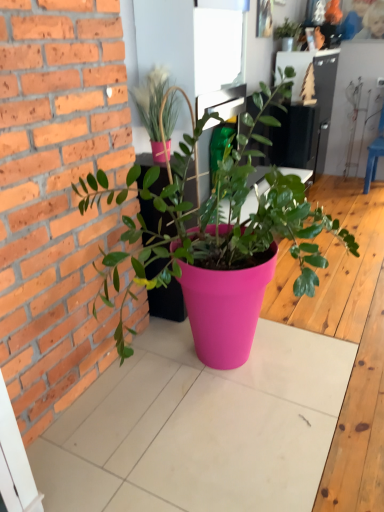
In order to face matte green plant at upper center, which ranks as the first houseplant in back-to-front order, should I rotate leftwards or rightwards?

Rotate your view right by about 12.930°.

Image resolution: width=384 pixels, height=512 pixels. What do you see at coordinates (288, 35) in the screenshot?
I see `matte green plant at upper center, which ranks as the first houseplant in back-to-front order` at bounding box center [288, 35].

I want to click on pink plastic pot at center, acting as the 3th houseplant starting from the top, so click(231, 236).

Does pink plastic pot at center, arranged as the third houseplant when viewed from the back, turn towards blue plastic chair at right?

No.

Do you think pink plastic pot at center, arranged as the first houseplant when viewed from the front, is within blue plastic chair at right, or outside of it?

pink plastic pot at center, arranged as the first houseplant when viewed from the front, is located beyond the bounds of blue plastic chair at right.

From the image's perspective, which one is positioned higher, pink plastic pot at center, arranged as the first houseplant when viewed from the front, or blue plastic chair at right?

blue plastic chair at right, from the image's perspective.

Considering the sizes of objects matte pink pot at upper center, the second houseplant in the front-to-back sequence, and pink plastic pot at center, arranged as the first houseplant when viewed from the front, in the image provided, who is taller, matte pink pot at upper center, the second houseplant in the front-to-back sequence, or pink plastic pot at center, arranged as the first houseplant when viewed from the front,?

pink plastic pot at center, arranged as the first houseplant when viewed from the front.

From the image's perspective, relative to pink plastic pot at center, arranged as the third houseplant when viewed from the back, is matte pink pot at upper center, acting as the second houseplant starting from the bottom, above or below?

matte pink pot at upper center, acting as the second houseplant starting from the bottom, is situated higher than pink plastic pot at center, arranged as the third houseplant when viewed from the back, in the image.

Is matte pink pot at upper center, arranged as the second houseplant when viewed from the top, not within pink plastic pot at center, acting as the 3th houseplant starting from the top?

That's incorrect, matte pink pot at upper center, arranged as the second houseplant when viewed from the top, is not completely outside pink plastic pot at center, acting as the 3th houseplant starting from the top.

How many degrees apart are the facing directions of matte pink pot at upper center, the second houseplant in the front-to-back sequence, and pink plastic pot at center, acting as the 3th houseplant starting from the top?

They differ by 0.088 degrees in their facing directions.

Is blue plastic chair at right at the back of matte pink pot at upper center, the second houseplant in the front-to-back sequence?

No, matte pink pot at upper center, the second houseplant in the front-to-back sequence, is not facing away from blue plastic chair at right.

Is matte pink pot at upper center, arranged as the second houseplant when viewed from the top, taller or shorter than blue plastic chair at right?

Considering their sizes, matte pink pot at upper center, arranged as the second houseplant when viewed from the top, has less height than blue plastic chair at right.

Between point (147, 128) and point (382, 134), which one is positioned behind?

Point (382, 134)

Between matte pink pot at upper center, the second houseplant in the front-to-back sequence, and blue plastic chair at right, which one has smaller size?

A: matte pink pot at upper center, the second houseplant in the front-to-back sequence, is smaller.

Locate an element on the screen. the 1st houseplant in front of the blue plastic chair at right is located at coordinates (288, 35).

Is matte green plant at upper center, the 3th houseplant viewed from the front, taller than blue plastic chair at right?

No, matte green plant at upper center, the 3th houseplant viewed from the front, is not taller than blue plastic chair at right.

Which is more to the left, matte green plant at upper center, the first houseplant positioned from the top, or blue plastic chair at right?

From the viewer's perspective, matte green plant at upper center, the first houseplant positioned from the top, appears more on the left side.

In order to click on houseplant that is the 3rd one when counting leftward from the blue plastic chair at right in this screenshot , I will do `click(152, 106)`.

How many degrees apart are the facing directions of blue plastic chair at right and matte pink pot at upper center, acting as the second houseplant starting from the bottom?

The angular difference between blue plastic chair at right and matte pink pot at upper center, acting as the second houseplant starting from the bottom, is 91.3 degrees.

Does point (383, 137) come in front of point (150, 141)?

No, (383, 137) is further to viewer.

Can you confirm if blue plastic chair at right is wider than matte pink pot at upper center, acting as the second houseplant starting from the bottom?

Yes, blue plastic chair at right is wider than matte pink pot at upper center, acting as the second houseplant starting from the bottom.

Is matte green plant at upper center, which ranks as the first houseplant in back-to-front order, not close to pink plastic pot at center, marked as the 1th houseplant in a bottom-to-top arrangement?

Yes, matte green plant at upper center, which ranks as the first houseplant in back-to-front order, and pink plastic pot at center, marked as the 1th houseplant in a bottom-to-top arrangement, are located far from each other.

Is matte green plant at upper center, the third houseplant when ordered from bottom to top, completely or partially outside of pink plastic pot at center, arranged as the first houseplant when viewed from the front?

Absolutely, matte green plant at upper center, the third houseplant when ordered from bottom to top, is external to pink plastic pot at center, arranged as the first houseplant when viewed from the front.

Considering their positions, is matte green plant at upper center, which ranks as the first houseplant in back-to-front order, located in front of or behind pink plastic pot at center, arranged as the first houseplant when viewed from the front?

Clearly, matte green plant at upper center, which ranks as the first houseplant in back-to-front order, is behind pink plastic pot at center, arranged as the first houseplant when viewed from the front.

From the picture: From a real-world perspective, between matte green plant at upper center, the 3th houseplant viewed from the front, and pink plastic pot at center, arranged as the third houseplant when viewed from the back, who is vertically higher?

In real-world perspective, matte green plant at upper center, the 3th houseplant viewed from the front, is above.

Considering the sizes of objects pink plastic pot at center, arranged as the first houseplant when viewed from the front, and matte green plant at upper center, the 3th houseplant viewed from the front, in the image provided, who is taller, pink plastic pot at center, arranged as the first houseplant when viewed from the front, or matte green plant at upper center, the 3th houseplant viewed from the front,?

pink plastic pot at center, arranged as the first houseplant when viewed from the front, is taller.

Find the location of a particular element. This screenshot has height=512, width=384. the 2nd houseplant above the pink plastic pot at center, arranged as the third houseplant when viewed from the back (from the image's perspective) is located at coordinates (288, 35).

Considering the sizes of pink plastic pot at center, acting as the 3th houseplant starting from the top, and matte green plant at upper center, which ranks as the first houseplant in back-to-front order, in the image, is pink plastic pot at center, acting as the 3th houseplant starting from the top, bigger or smaller than matte green plant at upper center, which ranks as the first houseplant in back-to-front order,?

Considering their sizes, pink plastic pot at center, acting as the 3th houseplant starting from the top, takes up more space than matte green plant at upper center, which ranks as the first houseplant in back-to-front order.

The height and width of the screenshot is (512, 384). I want to click on houseplant that is the 2nd one when counting downward from the blue plastic chair at right (from the image's perspective), so click(x=231, y=236).

Locate an element on the screen. The image size is (384, 512). houseplant that appears below the matte pink pot at upper center, the second houseplant in the front-to-back sequence (from a real-world perspective) is located at coordinates (231, 236).

When comparing their distances from matte green plant at upper center, the 3th houseplant viewed from the front, does pink plastic pot at center, arranged as the first houseplant when viewed from the front, or matte pink pot at upper center, arranged as the second houseplant when viewed from the top, seem closer?

matte pink pot at upper center, arranged as the second houseplant when viewed from the top, lies closer to matte green plant at upper center, the 3th houseplant viewed from the front, than the other object.

Based on their spatial positions, is matte green plant at upper center, the 3th houseplant viewed from the front, or matte pink pot at upper center, arranged as the second houseplant when viewed from the top, further from blue plastic chair at right?

The object further to blue plastic chair at right is matte pink pot at upper center, arranged as the second houseplant when viewed from the top.

Estimate the real-world distances between objects in this image. Which object is further from matte green plant at upper center, the third houseplant when ordered from bottom to top, blue plastic chair at right or matte pink pot at upper center, arranged as the second houseplant when viewed from the top?

matte pink pot at upper center, arranged as the second houseplant when viewed from the top, is positioned further to the anchor matte green plant at upper center, the third houseplant when ordered from bottom to top.

Looking at the image, which one is located closer to matte pink pot at upper center, the second houseplant in the front-to-back sequence, matte green plant at upper center, which ranks as the first houseplant in back-to-front order, or blue plastic chair at right?

matte green plant at upper center, which ranks as the first houseplant in back-to-front order.

Which object lies nearer to the anchor point matte pink pot at upper center, which is the 2th houseplant from back to front, matte green plant at upper center, the third houseplant when ordered from bottom to top, or pink plastic pot at center, arranged as the third houseplant when viewed from the back?

pink plastic pot at center, arranged as the third houseplant when viewed from the back, is closer to matte pink pot at upper center, which is the 2th houseplant from back to front.

Looking at the image, which one is located closer to matte green plant at upper center, the first houseplant positioned from the top, pink plastic pot at center, marked as the 1th houseplant in a bottom-to-top arrangement, or blue plastic chair at right?

Among the two, blue plastic chair at right is located nearer to matte green plant at upper center, the first houseplant positioned from the top.

Based on their spatial positions, is matte pink pot at upper center, arranged as the second houseplant when viewed from the top, or matte green plant at upper center, the first houseplant positioned from the top, further from pink plastic pot at center, arranged as the third houseplant when viewed from the back?

matte green plant at upper center, the first houseplant positioned from the top, lies further to pink plastic pot at center, arranged as the third houseplant when viewed from the back, than the other object.

From the image, which object appears to be farther from blue plastic chair at right, matte pink pot at upper center, which is the 2th houseplant from back to front, or pink plastic pot at center, arranged as the third houseplant when viewed from the back?

matte pink pot at upper center, which is the 2th houseplant from back to front, lies further to blue plastic chair at right than the other object.

Identify the location of houseplant between pink plastic pot at center, arranged as the third houseplant when viewed from the back, and matte green plant at upper center, the first houseplant positioned from the top, in the front-back direction. (152, 106).